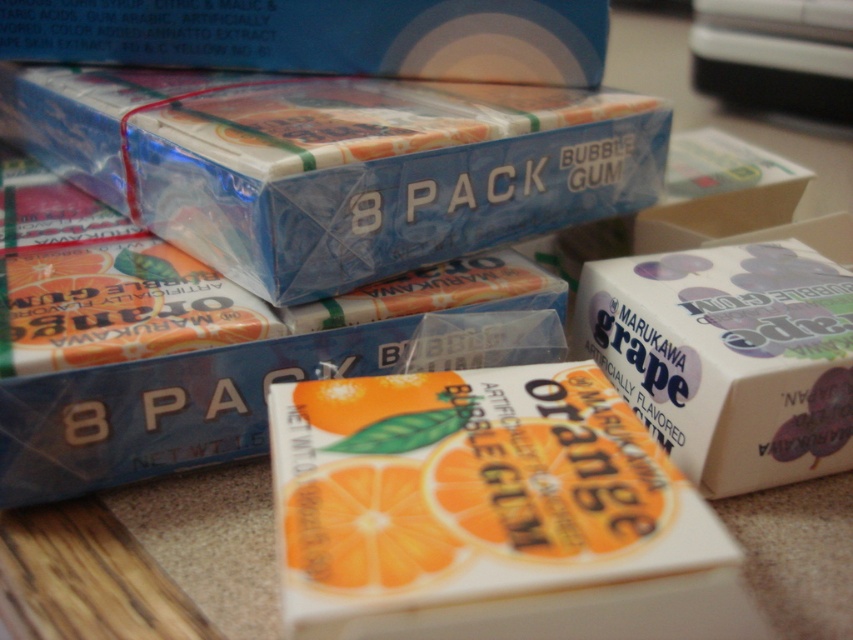
Question: Which point is farther to the camera?

Choices:
 (A) tap(292, 445)
 (B) tap(173, 378)
 (C) tap(334, 502)
 (D) tap(160, 3)

Answer: (D)

Question: Does white matte grape bubble gum at center appear under matte plastic bubble gum at upper center?

Choices:
 (A) yes
 (B) no

Answer: (A)

Question: Which object is the closest to the matte orange bubblegum at center?

Choices:
 (A) matte plastic bubble gum at upper center
 (B) white matte grape bubble gum at center

Answer: (B)

Question: Which of the following is the farthest from the observer?

Choices:
 (A) (550, 624)
 (B) (341, 10)
 (C) (146, 444)
 (D) (175, 172)

Answer: (B)

Question: Is white glossy bubble gum at center thinner than white matte grape bubble gum at center?

Choices:
 (A) no
 (B) yes

Answer: (A)

Question: Considering the relative positions of white glossy bubble gum at center and matte plastic bubble gum at upper center in the image provided, where is white glossy bubble gum at center located with respect to matte plastic bubble gum at upper center?

Choices:
 (A) right
 (B) left

Answer: (A)